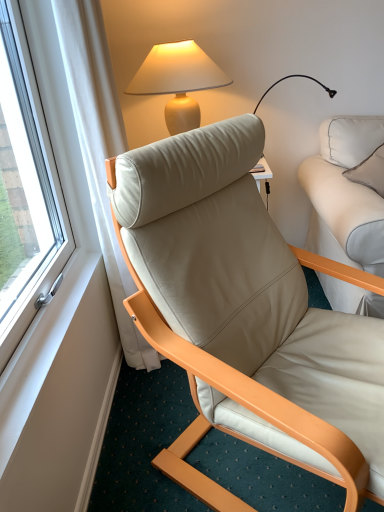
This screenshot has width=384, height=512. Find the location of `matte beige lamp at upper center`. matte beige lamp at upper center is located at coordinates (178, 81).

What do you see at coordinates (350, 139) in the screenshot?
I see `white leather pillow at upper right` at bounding box center [350, 139].

Locate an element on the screen. The height and width of the screenshot is (512, 384). matte beige lamp at upper center is located at coordinates (178, 81).

Which of these two, white leather pillow at upper right or beige leather chair at center, is thinner?

white leather pillow at upper right.

Would you consider white leather pillow at upper right to be distant from beige leather chair at center?

No, there isn't a large distance between white leather pillow at upper right and beige leather chair at center.

Considering the positions of objects white leather pillow at upper right and beige leather chair at center in the image provided, who is more to the right, white leather pillow at upper right or beige leather chair at center?

Positioned to the right is white leather pillow at upper right.

Which object is further away from the camera taking this photo, beige leather chair at center or matte beige lamp at upper center?

matte beige lamp at upper center is behind.

Is beige leather chair at center thinner than matte beige lamp at upper center?

No, beige leather chair at center is not thinner than matte beige lamp at upper center.

From the picture: Looking at the image, does beige leather chair at center seem bigger or smaller compared to matte beige lamp at upper center?

Considering their sizes, beige leather chair at center takes up more space than matte beige lamp at upper center.

Between point (352, 120) and point (155, 88), which one is positioned behind?

Positioned behind is point (352, 120).

In terms of height, does white leather pillow at upper right look taller or shorter compared to matte beige lamp at upper center?

In the image, white leather pillow at upper right appears to be shorter than matte beige lamp at upper center.

Can you confirm if matte beige lamp at upper center is taller than beige leather chair at center?

No.

Do you think matte beige lamp at upper center is within beige leather chair at center, or outside of it?

matte beige lamp at upper center cannot be found inside beige leather chair at center.

Between matte beige lamp at upper center and beige leather chair at center, which one has larger size?

beige leather chair at center.

Which object is wider, matte beige lamp at upper center or beige leather chair at center?

beige leather chair at center is wider.

Which object is thinner, beige leather chair at center or white leather pillow at upper right?

Thinner between the two is white leather pillow at upper right.

How many degrees apart are the facing directions of beige leather chair at center and white leather pillow at upper right?

They differ by 29.6 degrees in their facing directions.

Between point (378, 327) and point (346, 150), which one is positioned in front?

Positioned in front is point (378, 327).

Which of these two, beige leather chair at center or white leather pillow at upper right, is smaller?

white leather pillow at upper right.

Measure the distance between matte beige lamp at upper center and white leather pillow at upper right.

matte beige lamp at upper center is 27.00 inches from white leather pillow at upper right.

Can you confirm if matte beige lamp at upper center is taller than white leather pillow at upper right?

Correct, matte beige lamp at upper center is much taller as white leather pillow at upper right.

Is matte beige lamp at upper center placed right next to white leather pillow at upper right?

No, matte beige lamp at upper center is not making contact with white leather pillow at upper right.

From the image's perspective, which object appears higher, matte beige lamp at upper center or white leather pillow at upper right?

matte beige lamp at upper center, from the image's perspective.

The width and height of the screenshot is (384, 512). I want to click on chair lying in front of the white leather pillow at upper right, so (x=246, y=315).

This screenshot has width=384, height=512. What are the coordinates of `lamp positioned vertically above the beige leather chair at center (from a real-world perspective)` in the screenshot? It's located at (178, 81).

Considering their positions, is beige leather chair at center positioned further to matte beige lamp at upper center than white leather pillow at upper right?

beige leather chair at center.

From the image, which object appears to be nearer to matte beige lamp at upper center, white leather pillow at upper right or beige leather chair at center?

white leather pillow at upper right is positioned closer to the anchor matte beige lamp at upper center.

Looking at the image, which one is located further to white leather pillow at upper right, matte beige lamp at upper center or beige leather chair at center?

beige leather chair at center.

Considering their positions, is white leather pillow at upper right positioned closer to beige leather chair at center than matte beige lamp at upper center?

matte beige lamp at upper center lies closer to beige leather chair at center than the other object.

Based on their spatial positions, is beige leather chair at center or matte beige lamp at upper center further from white leather pillow at upper right?

beige leather chair at center is positioned further to the anchor white leather pillow at upper right.

Based on their spatial positions, is matte beige lamp at upper center or white leather pillow at upper right further from beige leather chair at center?

Based on the image, white leather pillow at upper right appears to be further to beige leather chair at center.

Identify the location of pillow between beige leather chair at center and matte beige lamp at upper center from front to back. (350, 139).